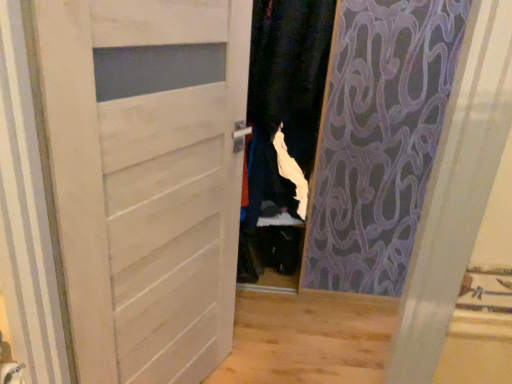
Question: Would you say white matte door at center is a long distance from white fabric at center?

Choices:
 (A) no
 (B) yes

Answer: (A)

Question: Is white matte door at center turned away from white fabric at center?

Choices:
 (A) no
 (B) yes

Answer: (A)

Question: Is white fabric at center a part of white matte door at center?

Choices:
 (A) yes
 (B) no

Answer: (B)

Question: Does white matte door at center come in front of white fabric at center?

Choices:
 (A) no
 (B) yes

Answer: (B)

Question: Considering the relative sizes of white matte door at center and white fabric at center in the image provided, is white matte door at center smaller than white fabric at center?

Choices:
 (A) no
 (B) yes

Answer: (B)

Question: Considering the relative positions of white matte door at center and white fabric at center in the image provided, is white matte door at center behind white fabric at center?

Choices:
 (A) yes
 (B) no

Answer: (B)

Question: Can you confirm if white fabric at center is thinner than white matte door at center?

Choices:
 (A) no
 (B) yes

Answer: (A)

Question: Does white fabric at center have a greater height compared to white matte door at center?

Choices:
 (A) no
 (B) yes

Answer: (A)

Question: From a real-world perspective, is white fabric at center located higher than white matte door at center?

Choices:
 (A) yes
 (B) no

Answer: (A)

Question: Is white matte door at center at the back of white fabric at center?

Choices:
 (A) no
 (B) yes

Answer: (A)

Question: Is white fabric at center directly adjacent to white matte door at center?

Choices:
 (A) no
 (B) yes

Answer: (A)

Question: Considering the relative positions of white fabric at center and white matte door at center in the image provided, is white fabric at center to the left of white matte door at center from the viewer's perspective?

Choices:
 (A) yes
 (B) no

Answer: (B)

Question: From their relative heights in the image, would you say white matte door at center is taller or shorter than white fabric at center?

Choices:
 (A) tall
 (B) short

Answer: (A)